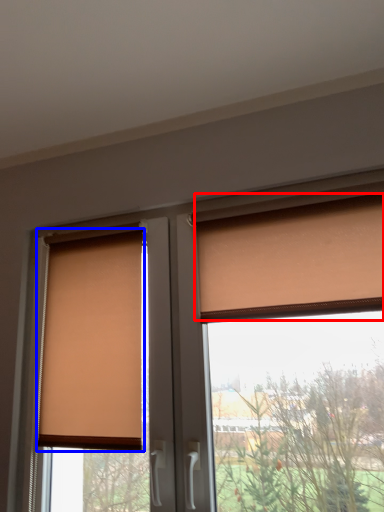
Question: Which object appears closest to the camera in this image, curtain (highlighted by a red box) or window blind (highlighted by a blue box)?

Choices:
 (A) curtain
 (B) window blind

Answer: (A)